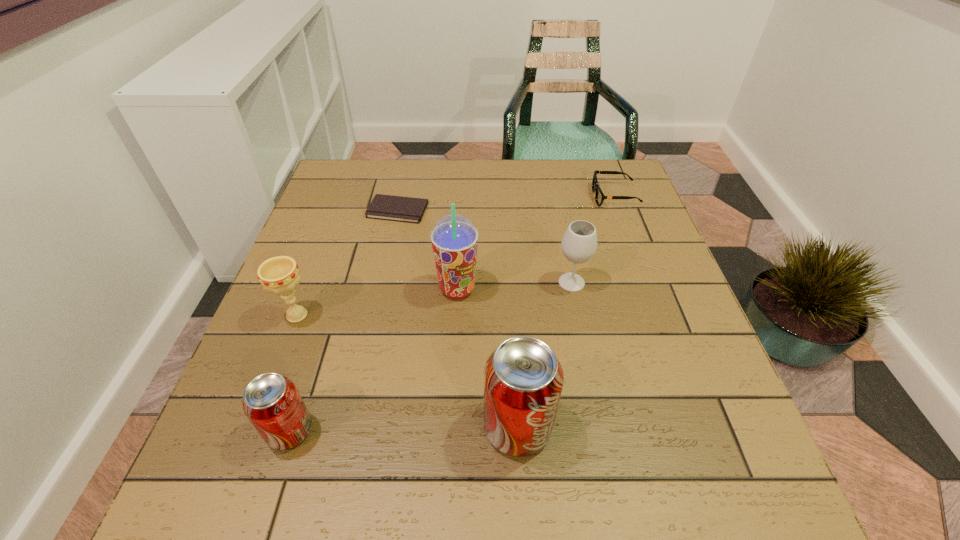
This screenshot has height=540, width=960. I want to click on sunglasses that is at the far edge, so click(599, 196).

Identify the location of soda can that is at the left edge. (272, 403).

At what (x,y) coordinates should I click in order to perform the action: click on checkbook situated at the left edge. Please return your answer as a coordinate pair (x, y). Looking at the image, I should click on (384, 207).

Find the location of a particular element. The width and height of the screenshot is (960, 540). chalice that is at the left edge is located at coordinates (280, 275).

The width and height of the screenshot is (960, 540). I want to click on object that is at the right edge, so click(x=599, y=196).

The width and height of the screenshot is (960, 540). I want to click on object present at the far left corner, so click(x=384, y=207).

Image resolution: width=960 pixels, height=540 pixels. Identify the location of object present at the near left corner. (272, 403).

Identify the location of object that is at the far right corner. (599, 196).

Identify the location of free space at the far edge. (493, 186).

The height and width of the screenshot is (540, 960). In the image, there is a desktop. Identify the location of free space at the left edge. (278, 364).